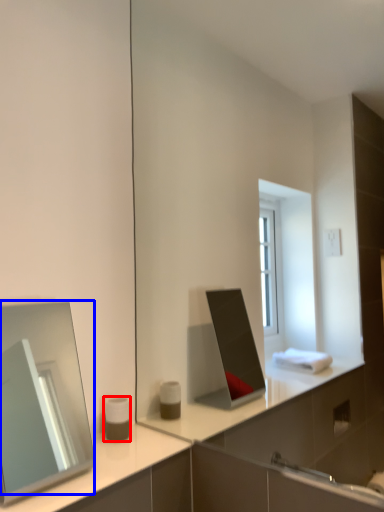
Question: Which object appears farthest to the camera in this image, toiletry (highlighted by a red box) or mirror (highlighted by a blue box)?

Choices:
 (A) toiletry
 (B) mirror

Answer: (A)